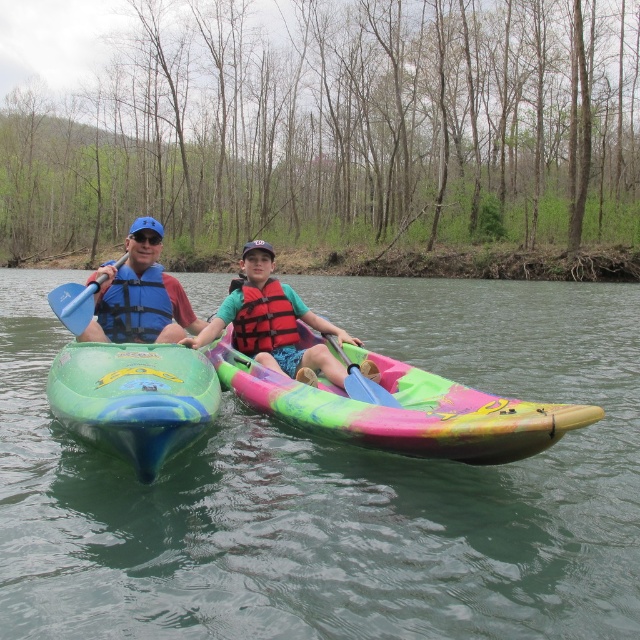
Looking at this image, you are a photographer trying to capture the multicolored plastic kayak at center in your shot. The camera you are using has a focus point at coordinate 0.64, 0.63. Will the kayak be in focus?

The 2D location of multicolored plastic kayak at center is at point (x=404, y=410), which is very close to the camera focus point at (x=403, y=409). Therefore, the kayak will be in focus.

Based on the photo, you are a photographer taking a picture of the two kayakers. You notice the blue plastic paddle at left and the blue plastic paddle at center. Which paddle should you focus on to ensure it appears in front of the other in the photo?

The blue plastic paddle at left should be focused on because it is above the blue plastic paddle at center, indicating it is closer to the camera and thus would appear in front.

You are a photographer trying to capture the blue plastic paddle at left in your shot. Based on its 2D coordinates, where should you position your camera to ensure it is centered in the frame?

The blue plastic paddle at left is located at coordinates 0.475 on the x axis and 0.117 on the y axis. To center it in the frame, position your camera so the paddle aligns with the center point of the image, which would be around the middle of the frame both horizontally and vertically.